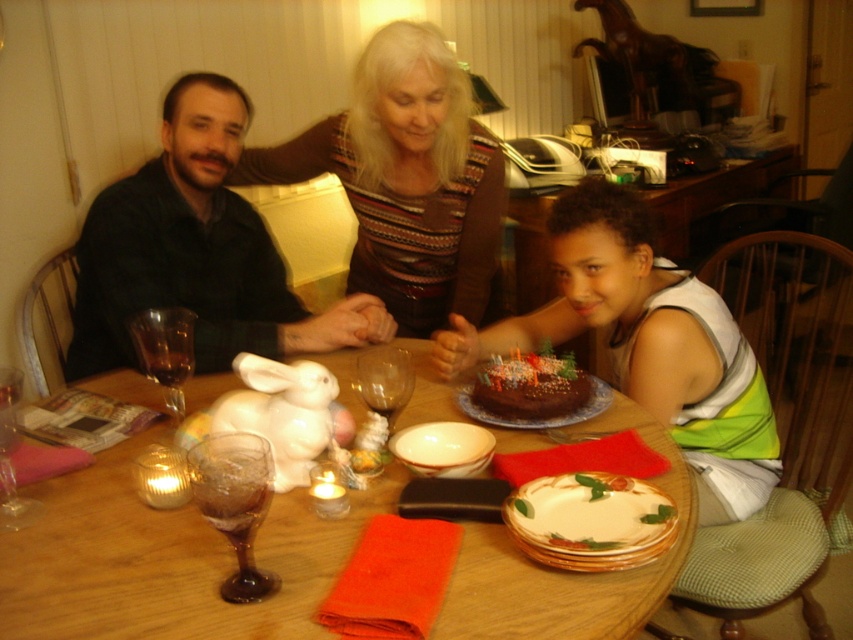
Question: Which of the following is the closest to the observer?

Choices:
 (A) (1, 513)
 (B) (248, 480)
 (C) (440, 323)

Answer: (B)

Question: Is brown textured sweater at upper center thinner than transparent glass wine glass at center?

Choices:
 (A) yes
 (B) no

Answer: (B)

Question: Which of the following is the farthest from the observer?

Choices:
 (A) (595, 490)
 (B) (498, 172)
 (C) (480, 564)

Answer: (B)

Question: Which point is farther to the camera?

Choices:
 (A) (599, 323)
 (B) (415, 140)
 (C) (526, 568)
 (D) (196, 470)

Answer: (B)

Question: Does matte chocolate cake at center have a larger size compared to transparent glass at table left?

Choices:
 (A) no
 (B) yes

Answer: (B)

Question: Is chocolatesmoothcake at center positioned behind transparent glass wine glass at table left?

Choices:
 (A) yes
 (B) no

Answer: (A)